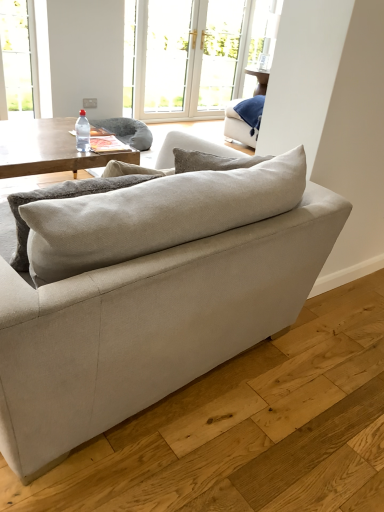
Question: Does point (89, 326) appear closer or farther from the camera than point (26, 167)?

Choices:
 (A) closer
 (B) farther

Answer: (A)

Question: Considering the positions of beige fabric couch at center and woodenwoodencoffee table at left in the image, is beige fabric couch at center wider or thinner than woodenwoodencoffee table at left?

Choices:
 (A) wide
 (B) thin

Answer: (A)

Question: Estimate the real-world distances between objects in this image. Which object is closer to the clear glass screen door at upper center?

Choices:
 (A) transparent plastic bottle at center
 (B) beige fabric couch at center
 (C) white glass door at upper center
 (D) woodenwoodencoffee table at left
 (E) white glossy window at upper center

Answer: (C)

Question: Based on their relative distances, which object is nearer to the beige fabric couch at center?

Choices:
 (A) white glossy window at upper center
 (B) woodenwoodencoffee table at left
 (C) white glass door at upper center
 (D) transparent plastic bottle at center
 (E) clear glass screen door at upper center

Answer: (B)